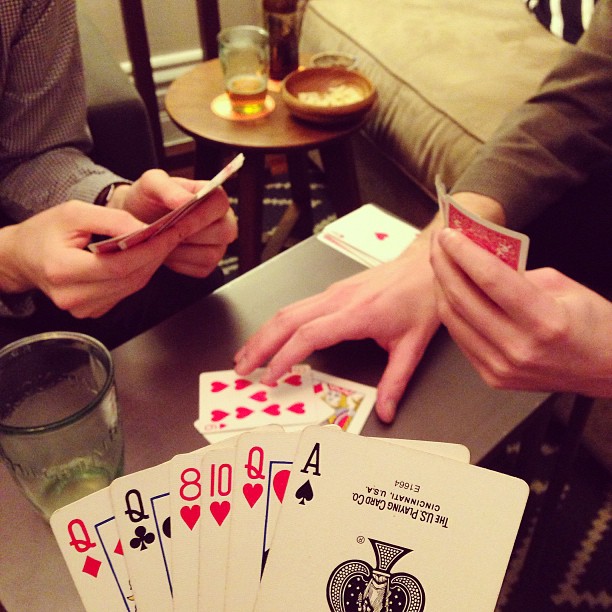
Identify the location of cup. (75, 412).